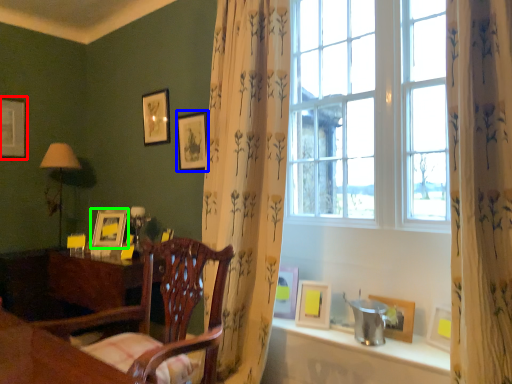
Question: Which object is positioned closest to picture frame (highlighted by a red box)? Select from picture frame (highlighted by a blue box) and picture frame (highlighted by a green box).

Choices:
 (A) picture frame
 (B) picture frame

Answer: (B)